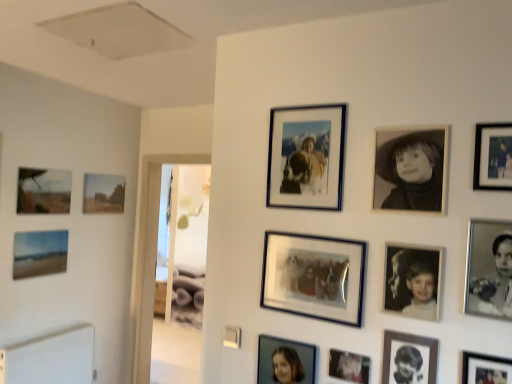
What do you see at coordinates (285, 361) in the screenshot? I see `matte silver photo frame at lower center, the fourth picture frame when ordered from left to right` at bounding box center [285, 361].

Where is `matte blue painting at lower left, the twelfth picture frame when ordered from front to back`? This screenshot has width=512, height=384. matte blue painting at lower left, the twelfth picture frame when ordered from front to back is located at coordinates (39, 253).

How much space does black matte portrait at upper right, the ninth picture frame in the left-to-right sequence, occupy vertically?

black matte portrait at upper right, the ninth picture frame in the left-to-right sequence, is 12.42 inches in height.

This screenshot has height=384, width=512. Describe the element at coordinates (306, 157) in the screenshot. I see `metallic silver photo frame at upper center, acting as the ninth picture frame starting from the right` at that location.

What are the coordinates of `matte silver photo frame at lower center, the fourth picture frame when ordered from left to right` in the screenshot? It's located at (285, 361).

Which is in front, matte blue painting at lower left, the 2th picture frame viewed from the back, or matte black photo frame at center-right, which is the 4th picture frame from right to left?

matte black photo frame at center-right, which is the 4th picture frame from right to left, is more forward.

Is matte blue painting at lower left, which ranks as the 1th picture frame in left-to-right order, positioned with its back to matte black photo frame at center-right, the tenth picture frame positioned from the left?

That's not correct — matte blue painting at lower left, which ranks as the 1th picture frame in left-to-right order, is not looking away from matte black photo frame at center-right, the tenth picture frame positioned from the left.

Consider the image. From the image's perspective, relative to matte black photo frame at center-right, which is the 4th picture frame from right to left, is matte blue painting at lower left, the 2th picture frame viewed from the back, above or below?

Clearly, from the image's perspective, matte blue painting at lower left, the 2th picture frame viewed from the back, is below matte black photo frame at center-right, which is the 4th picture frame from right to left.

Between matte blue painting at lower left, which appears as the thirteenth picture frame when viewed from the right, and matte black photo frame at center-right, which is counted as the ninth picture frame, starting from the back, which one has smaller width?

matte black photo frame at center-right, which is counted as the ninth picture frame, starting from the back.

Does matte brown landscape at left, acting as the 3th picture frame starting from the left, turn towards matte canvas painting at left, marked as the 2th picture frame in a left-to-right arrangement?

No, matte brown landscape at left, acting as the 3th picture frame starting from the left, is not turned towards matte canvas painting at left, marked as the 2th picture frame in a left-to-right arrangement.

Is matte brown landscape at left, which is counted as the thirteenth picture frame, starting from the front, taller or shorter than matte canvas painting at left, positioned as the 11th picture frame in front-to-back order?

Clearly, matte brown landscape at left, which is counted as the thirteenth picture frame, starting from the front, is shorter compared to matte canvas painting at left, positioned as the 11th picture frame in front-to-back order.

From the image's perspective, is matte brown landscape at left, acting as the 3th picture frame starting from the left, below matte canvas painting at left, positioned as the 11th picture frame in front-to-back order?

Yes, from the image's perspective, matte brown landscape at left, acting as the 3th picture frame starting from the left, is beneath matte canvas painting at left, positioned as the 11th picture frame in front-to-back order.

Is matte brown landscape at left, the 11th picture frame when ordered from right to left, with matte canvas painting at left, placed as the third picture frame when sorted from back to front?

No, matte brown landscape at left, the 11th picture frame when ordered from right to left, is not making contact with matte canvas painting at left, placed as the third picture frame when sorted from back to front.

Is matte canvas painting at left, positioned as the 11th picture frame in front-to-back order, not close to metallic silver photo frame at upper center, the ninth picture frame viewed from the front?

Indeed, matte canvas painting at left, positioned as the 11th picture frame in front-to-back order, is not near metallic silver photo frame at upper center, the ninth picture frame viewed from the front.

From a real-world perspective, does matte canvas painting at left, placed as the third picture frame when sorted from back to front, sit lower than metallic silver photo frame at upper center, the ninth picture frame viewed from the front?

Yes, from a real-world perspective, matte canvas painting at left, placed as the third picture frame when sorted from back to front, is beneath metallic silver photo frame at upper center, the ninth picture frame viewed from the front.

Can you confirm if matte canvas painting at left, placed as the 12th picture frame when sorted from right to left, is shorter than metallic silver photo frame at upper center, marked as the fifth picture frame in a left-to-right arrangement?

Yes, matte canvas painting at left, placed as the 12th picture frame when sorted from right to left, is shorter than metallic silver photo frame at upper center, marked as the fifth picture frame in a left-to-right arrangement.

From the picture: From the image's perspective, is matte blue painting at lower left, the 2th picture frame viewed from the back, located above or below black matte portrait at upper right, the ninth picture frame in the left-to-right sequence?

matte blue painting at lower left, the 2th picture frame viewed from the back, is situated lower than black matte portrait at upper right, the ninth picture frame in the left-to-right sequence, in the image.

Is matte blue painting at lower left, the twelfth picture frame when ordered from front to back, facing away from black matte portrait at upper right, marked as the sixth picture frame in a front-to-back arrangement?

No, matte blue painting at lower left, the twelfth picture frame when ordered from front to back,'s orientation is not away from black matte portrait at upper right, marked as the sixth picture frame in a front-to-back arrangement.

Between matte blue painting at lower left, the twelfth picture frame when ordered from front to back, and black matte portrait at upper right, which is the 8th picture frame from back to front, which one has larger size?

matte blue painting at lower left, the twelfth picture frame when ordered from front to back.

From a real-world perspective, between matte blue painting at lower left, the 2th picture frame viewed from the back, and matte silver photo frame at lower center, which is the fourth picture frame in back-to-front order, who is vertically lower?

In real-world perspective, matte silver photo frame at lower center, which is the fourth picture frame in back-to-front order, is lower.

Considering the relative positions of matte blue painting at lower left, the twelfth picture frame when ordered from front to back, and matte silver photo frame at lower center, the fourth picture frame when ordered from left to right, in the image provided, is matte blue painting at lower left, the twelfth picture frame when ordered from front to back, to the right of matte silver photo frame at lower center, the fourth picture frame when ordered from left to right, from the viewer's perspective?

No, matte blue painting at lower left, the twelfth picture frame when ordered from front to back, is not to the right of matte silver photo frame at lower center, the fourth picture frame when ordered from left to right.

Is matte blue painting at lower left, the 2th picture frame viewed from the back, bigger or smaller than matte silver photo frame at lower center, the fourth picture frame when ordered from left to right?

Considering their sizes, matte blue painting at lower left, the 2th picture frame viewed from the back, takes up more space than matte silver photo frame at lower center, the fourth picture frame when ordered from left to right.

Is metallic silver photo frame at lower center, the seventh picture frame from the right, not near metallic silver photo frame at upper center, which is the 5th picture frame from back to front?

No.

Between metallic silver photo frame at lower center, which is the 7th picture frame in back-to-front order, and metallic silver photo frame at upper center, acting as the ninth picture frame starting from the right, which one has larger size?

metallic silver photo frame at upper center, acting as the ninth picture frame starting from the right.

Starting from the metallic silver photo frame at upper center, which is the 5th picture frame from back to front, which picture frame is the 2nd one to the right? Please provide its 2D coordinates.

[(349, 366)]

In terms of height, does frosted glass photo frame at center, which is the 8th picture frame from front to back, look taller or shorter compared to matte silver photo frame at lower center, which is the fourth picture frame in back-to-front order?

Considering their sizes, frosted glass photo frame at center, which is the 8th picture frame from front to back, has more height than matte silver photo frame at lower center, which is the fourth picture frame in back-to-front order.

Is frosted glass photo frame at center, which ranks as the 6th picture frame in left-to-right order, positioned before matte silver photo frame at lower center, the fourth picture frame when ordered from left to right?

Yes, frosted glass photo frame at center, which ranks as the 6th picture frame in left-to-right order, is closer to the viewer.

From a real-world perspective, which object stands above the other?

frosted glass photo frame at center, which is counted as the eighth picture frame, starting from the right, is physically above.

Is frosted glass photo frame at center, which is counted as the eighth picture frame, starting from the right, not near matte silver photo frame at lower center, the 10th picture frame positioned from the right?

They are positioned close to each other.

Locate an element on the screen. picture frame that is the 2nd one when counting downward from the matte black photo frame at center-right, which is counted as the ninth picture frame, starting from the back (from the image's perspective) is located at coordinates (39, 253).

In order to click on the 2nd picture frame in front of the matte brown landscape at left, acting as the 3th picture frame starting from the left in this screenshot , I will do `click(42, 191)`.

Considering their positions, is matte silver photo frame at lower center, the 10th picture frame positioned from the right, positioned closer to matte black picture frame at upper right, which is counted as the thirteenth picture frame, starting from the left, than metallic silver photo frame at lower center, placed as the 7th picture frame when sorted from front to back?

The object closer to matte black picture frame at upper right, which is counted as the thirteenth picture frame, starting from the left, is metallic silver photo frame at lower center, placed as the 7th picture frame when sorted from front to back.

Based on their spatial positions, is black glossy photo frame at lower right, which is the 2th picture frame in right-to-left order, or matte silver photo frame at lower center, which is the fourth picture frame in back-to-front order, closer to metallic silver photo frame at upper center, the ninth picture frame viewed from the front?

Based on the image, black glossy photo frame at lower right, which is the 2th picture frame in right-to-left order, appears to be nearer to metallic silver photo frame at upper center, the ninth picture frame viewed from the front.

Considering their positions, is matte black picture frame at upper right, placed as the eleventh picture frame when sorted from back to front, positioned closer to frosted glass photo frame at center, which is counted as the eighth picture frame, starting from the right, than black glossy photo frame at lower right, marked as the 12th picture frame in a left-to-right arrangement?

black glossy photo frame at lower right, marked as the 12th picture frame in a left-to-right arrangement, is positioned closer to the anchor frosted glass photo frame at center, which is counted as the eighth picture frame, starting from the right.

Considering their positions, is matte blue painting at lower left, which appears as the thirteenth picture frame when viewed from the right, positioned closer to matte canvas painting at left, marked as the 2th picture frame in a left-to-right arrangement, than metallic silver photo frame at lower right, which is the 11th picture frame in left-to-right order?

matte blue painting at lower left, which appears as the thirteenth picture frame when viewed from the right, lies closer to matte canvas painting at left, marked as the 2th picture frame in a left-to-right arrangement, than the other object.

From the image, which object appears to be nearer to matte canvas painting at left, placed as the third picture frame when sorted from back to front, matte black photo frame at center-right, which is the 4th picture frame from right to left, or matte brown landscape at left, the first picture frame when ordered from back to front?

matte brown landscape at left, the first picture frame when ordered from back to front.

Looking at the image, which one is located further to metallic silver photo frame at lower center, which is the 7th picture frame in back-to-front order, frosted glass photo frame at center, which is the 8th picture frame from front to back, or black glossy photo frame at lower right, which is the eighth picture frame from left to right?

frosted glass photo frame at center, which is the 8th picture frame from front to back.

Which object lies further to the anchor point matte black photo frame at center-right, which is counted as the ninth picture frame, starting from the back, black glossy photo frame at lower right, which appears as the tenth picture frame when viewed from the back, or matte canvas painting at left, positioned as the 11th picture frame in front-to-back order?

matte canvas painting at left, positioned as the 11th picture frame in front-to-back order, is positioned further to the anchor matte black photo frame at center-right, which is counted as the ninth picture frame, starting from the back.

From the image, which object appears to be nearer to black glossy photo frame at lower right, the fourth picture frame in the front-to-back sequence, matte canvas painting at left, positioned as the 11th picture frame in front-to-back order, or matte black picture frame at upper right, which is counted as the thirteenth picture frame, starting from the left?

The object closer to black glossy photo frame at lower right, the fourth picture frame in the front-to-back sequence, is matte black picture frame at upper right, which is counted as the thirteenth picture frame, starting from the left.

Locate an element on the screen. This screenshot has width=512, height=384. picture frame situated between matte canvas painting at left, placed as the 12th picture frame when sorted from right to left, and matte silver photo frame at lower center, placed as the tenth picture frame when sorted from front to back, from left to right is located at coordinates (103, 193).

You are a GUI agent. You are given a task and a screenshot of the screen. Output one action in this format:
    pyautogui.click(x=<x>, y=<y>)
    Task: Click on the picture frame between matte canvas painting at left, placed as the third picture frame when sorted from back to front, and matte brown landscape at left, the 11th picture frame when ordered from right to left, along the z-axis
    The width and height of the screenshot is (512, 384).
    Given the screenshot: What is the action you would take?
    pyautogui.click(x=39, y=253)